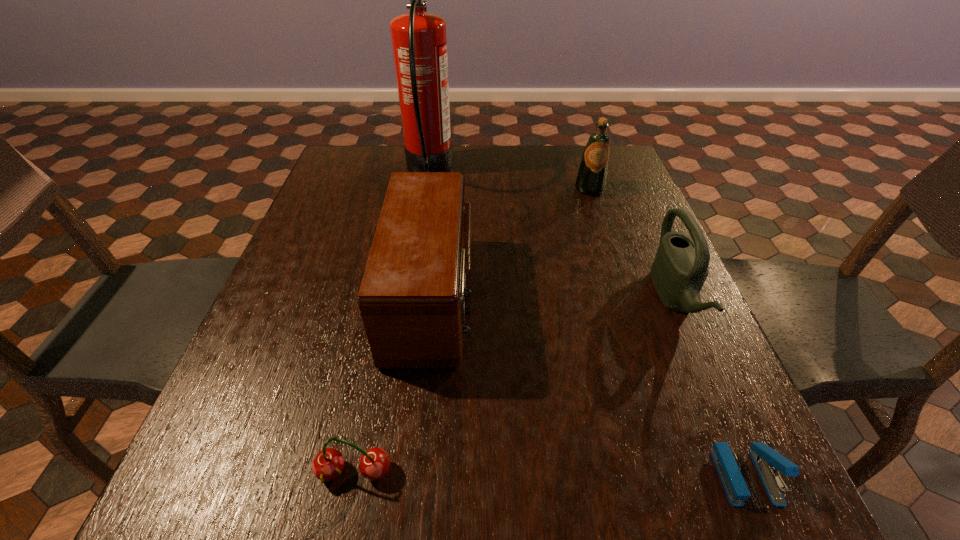
I want to click on vacant area located on the spout of the watering can, so click(620, 299).

The width and height of the screenshot is (960, 540). I want to click on blank area located on the spout of the watering can, so click(478, 299).

You are a GUI agent. You are given a task and a screenshot of the screen. Output one action in this format:
    pyautogui.click(x=<x>, y=<y>)
    Task: Click on the free location located on the left of the shortest object
    The image size is (960, 540).
    Given the screenshot: What is the action you would take?
    pyautogui.click(x=680, y=476)

Identify the location of fire extinguisher located in the far edge section of the desktop. (419, 39).

You are a GUI agent. You are given a task and a screenshot of the screen. Output one action in this format:
    pyautogui.click(x=<x>, y=<y>)
    Task: Click on the olive oil present at the far edge
    The image size is (960, 540).
    Given the screenshot: What is the action you would take?
    pyautogui.click(x=591, y=179)

Find the location of a particular element. cherry positioned at the near edge is located at coordinates (328, 464).

What are the coordinates of `stapler that is at the near edge` in the screenshot? It's located at (767, 461).

Image resolution: width=960 pixels, height=540 pixels. In order to click on olive oil located in the right edge section of the desktop in this screenshot , I will do `click(591, 179)`.

Where is `watering can present at the right edge`? watering can present at the right edge is located at coordinates (680, 267).

At what (x,y) coordinates should I click in order to perform the action: click on stapler at the right edge. Please return your answer as a coordinate pair (x, y). Looking at the image, I should click on (767, 461).